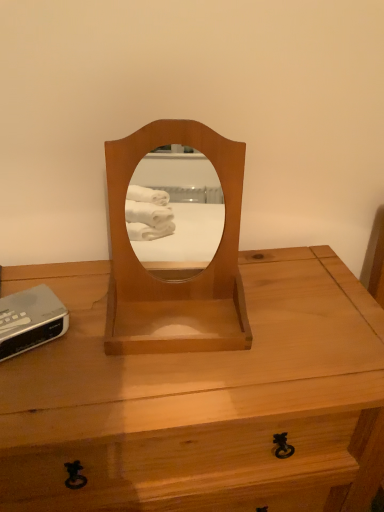
Image resolution: width=384 pixels, height=512 pixels. What are the coordinates of `vacant region to the right of silver plastic clock at lower left` in the screenshot? It's located at (105, 349).